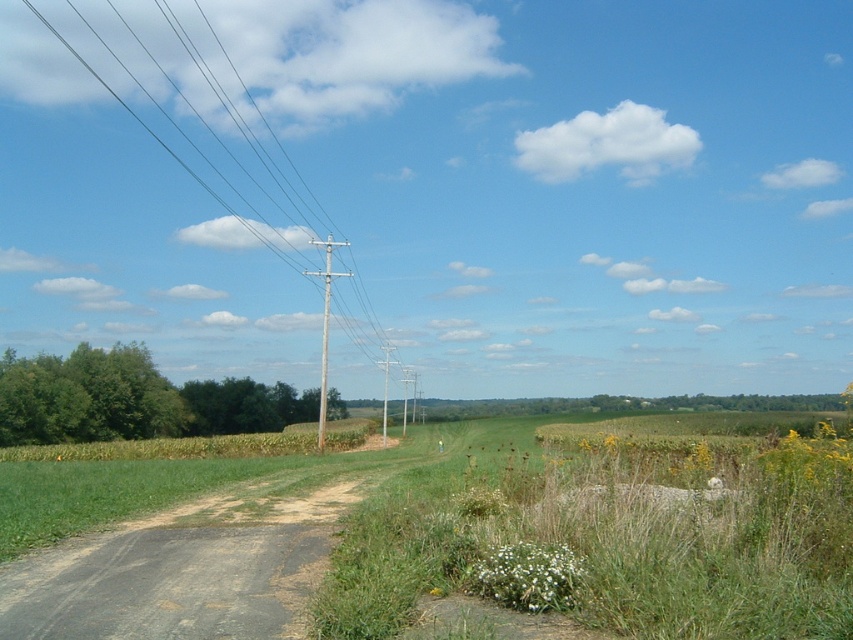
Does dull gray asphalt at lower left have a larger size compared to metallic wire at upper left?

Actually, dull gray asphalt at lower left might be smaller than metallic wire at upper left.

Which is behind, point (107, 564) or point (303, 264)?

Point (303, 264)

Find the location of a particular element. This screenshot has height=640, width=853. dull gray asphalt at lower left is located at coordinates (187, 566).

Is point (267, 532) farther from camera compared to point (328, 292)?

No, (267, 532) is in front of (328, 292).

Between dull gray asphalt at lower left and brown wooden telegraph pole at center, which one appears on the right side from the viewer's perspective?

From the viewer's perspective, dull gray asphalt at lower left appears more on the right side.

Describe the element at coordinates (187, 566) in the screenshot. This screenshot has width=853, height=640. I see `dull gray asphalt at lower left` at that location.

What are the coordinates of `dull gray asphalt at lower left` in the screenshot? It's located at (187, 566).

Can you confirm if metallic wire at upper left is bigger than brown wooden telegraph pole at center?

Correct, metallic wire at upper left is larger in size than brown wooden telegraph pole at center.

Does metallic wire at upper left appear over brown wooden telegraph pole at center?

Yes, metallic wire at upper left is above brown wooden telegraph pole at center.

The width and height of the screenshot is (853, 640). Identify the location of metallic wire at upper left. (194, 113).

The height and width of the screenshot is (640, 853). Find the location of `metallic wire at upper left`. metallic wire at upper left is located at coordinates (194, 113).